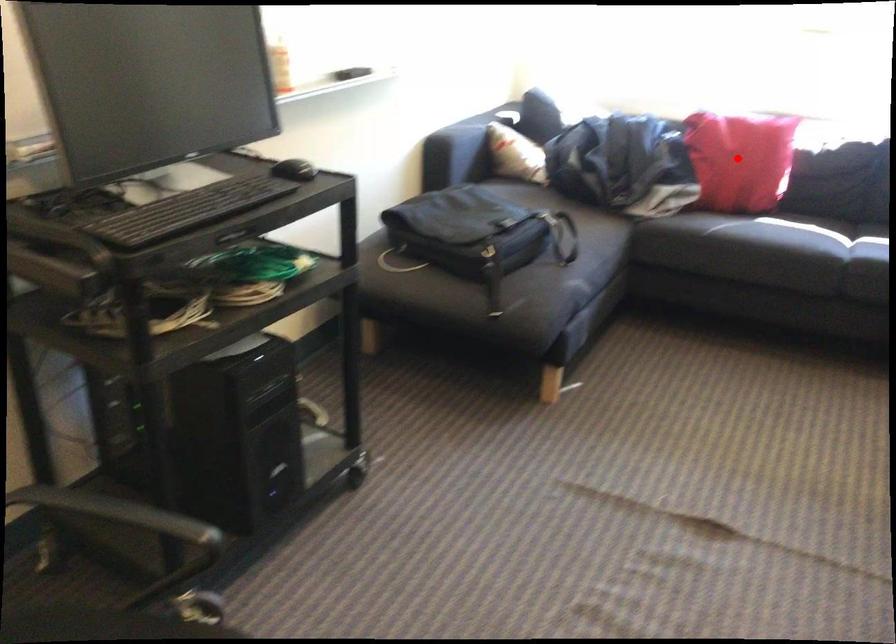
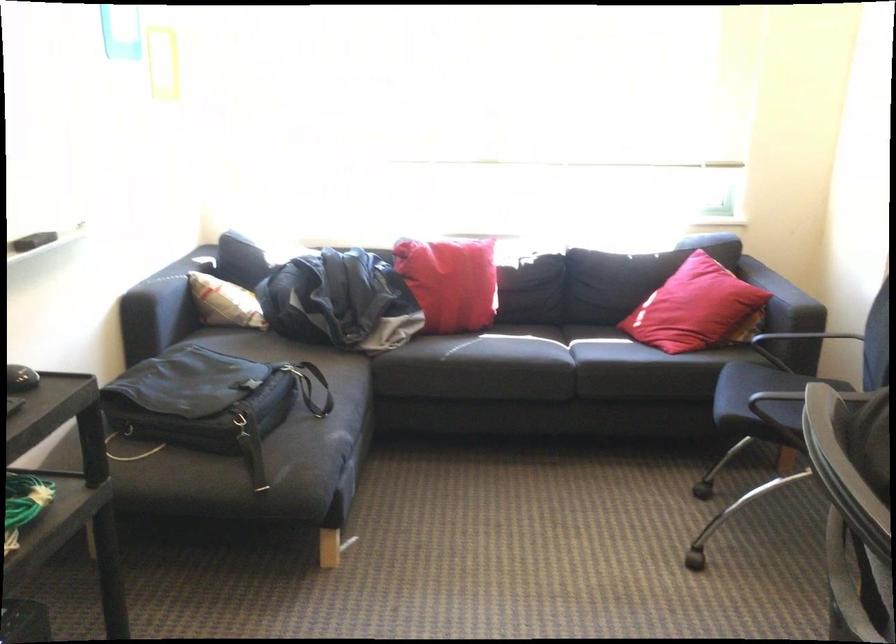
Where in the second image is the point corresponding to the highlighted location from the first image?

(450, 281)